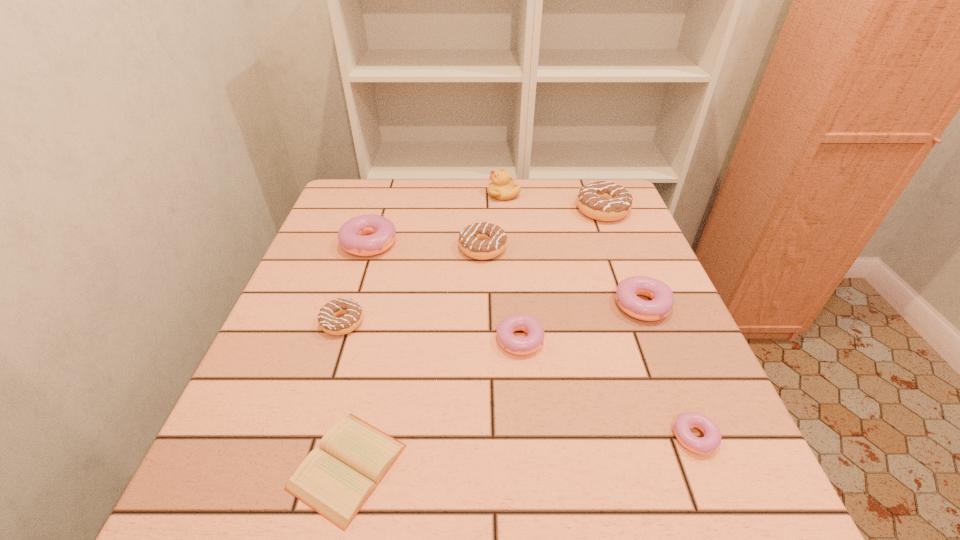
Identify the location of the nearest chocolate doughnut. (353, 314).

The image size is (960, 540). What are the coordinates of `the second purple doughnut from left to right` in the screenshot? It's located at (508, 341).

This screenshot has width=960, height=540. Find the location of `the nearest doughnut`. the nearest doughnut is located at coordinates (712, 438).

At what (x,y) coordinates should I click in order to perform the action: click on the smallest purple doughnut. Please return your answer as a coordinate pair (x, y). The height and width of the screenshot is (540, 960). Looking at the image, I should click on (712, 438).

Where is `the shortest object`? The height and width of the screenshot is (540, 960). the shortest object is located at coordinates (x=335, y=480).

You are a GUI agent. You are given a task and a screenshot of the screen. Output one action in this format:
    pyautogui.click(x=<x>, y=<y>)
    Task: Click on the vacant region located on the front-facing side of the duckling
    
    Given the screenshot: What is the action you would take?
    pyautogui.click(x=399, y=194)

Where is `vacant space located on the front-facing side of the duckling`? This screenshot has width=960, height=540. vacant space located on the front-facing side of the duckling is located at coordinates (423, 194).

Image resolution: width=960 pixels, height=540 pixels. In order to click on vacant space located on the front-facing side of the duckling in this screenshot , I will do `click(413, 194)`.

I want to click on vacant space situated on the front of the biggest chocolate doughnut, so click(639, 307).

This screenshot has width=960, height=540. Identify the location of free location located 0.240m on the right of the leftmost purple doughnut. (492, 239).